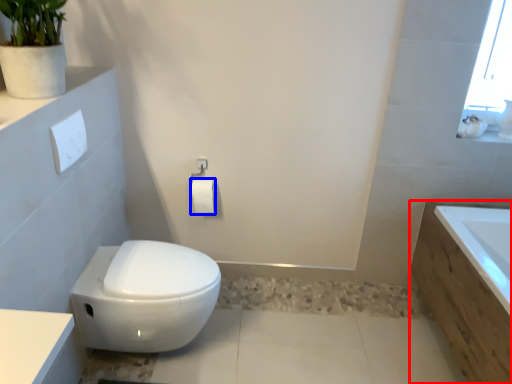
Question: Among these objects, which one is nearest to the camera, bath (highlighted by a red box) or toilet paper (highlighted by a blue box)?

Choices:
 (A) bath
 (B) toilet paper

Answer: (A)